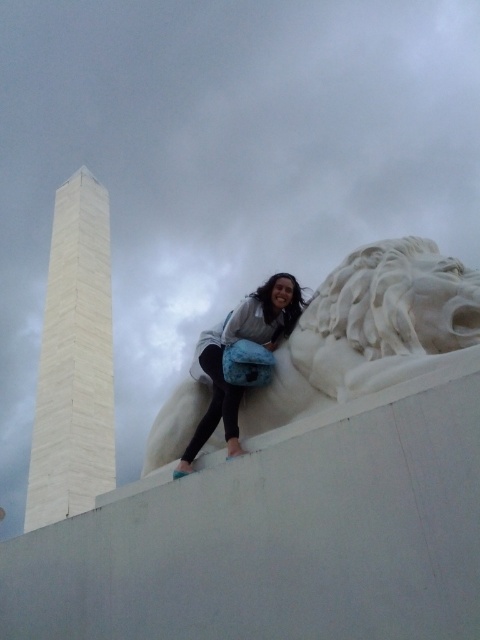
Question: Can you confirm if white marble lion head at upper center is wider than matte white statue at upper center?

Choices:
 (A) yes
 (B) no

Answer: (A)

Question: Which point is closer to the camera?

Choices:
 (A) white marble lion head at upper center
 (B) matte white statue at upper center

Answer: (A)

Question: From the image, what is the correct spatial relationship of white marble lion head at upper center in relation to matte white statue at upper center?

Choices:
 (A) right
 (B) left

Answer: (A)

Question: Does white marble lion head at upper center appear over matte white statue at upper center?

Choices:
 (A) yes
 (B) no

Answer: (B)

Question: Which of the following is the closest to the observer?

Choices:
 (A) white marble lion head at upper center
 (B) matte white statue at upper center

Answer: (A)

Question: Which object is farther from the camera taking this photo?

Choices:
 (A) white marble lion head at upper center
 (B) matte white statue at upper center

Answer: (B)